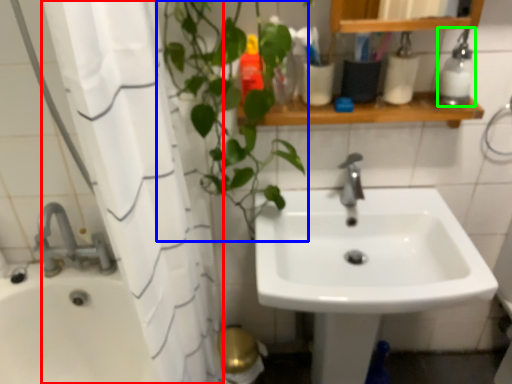
Question: Considering the real-world distances, which object is farthest from shower curtain (highlighted by a red box)? vegetation (highlighted by a blue box) or soap dispenser (highlighted by a green box)?

Choices:
 (A) vegetation
 (B) soap dispenser

Answer: (B)